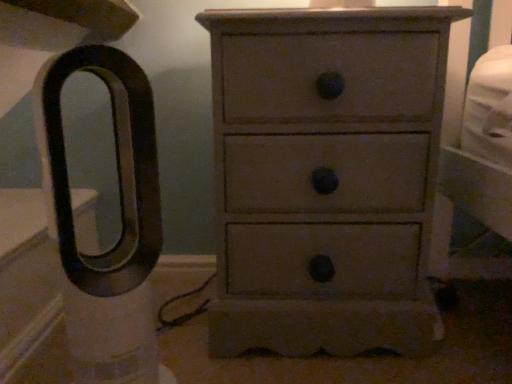
Find the location of a particular element. The height and width of the screenshot is (384, 512). light brown wood chest of drawers at center is located at coordinates (326, 177).

What do you see at coordinates (326, 177) in the screenshot? I see `light brown wood chest of drawers at center` at bounding box center [326, 177].

You are a GUI agent. You are given a task and a screenshot of the screen. Output one action in this format:
    pyautogui.click(x=<x>, y=<y>)
    Task: Click on the light brown wood chest of drawers at center
    The image size is (512, 384).
    Given the screenshot: What is the action you would take?
    pyautogui.click(x=326, y=177)